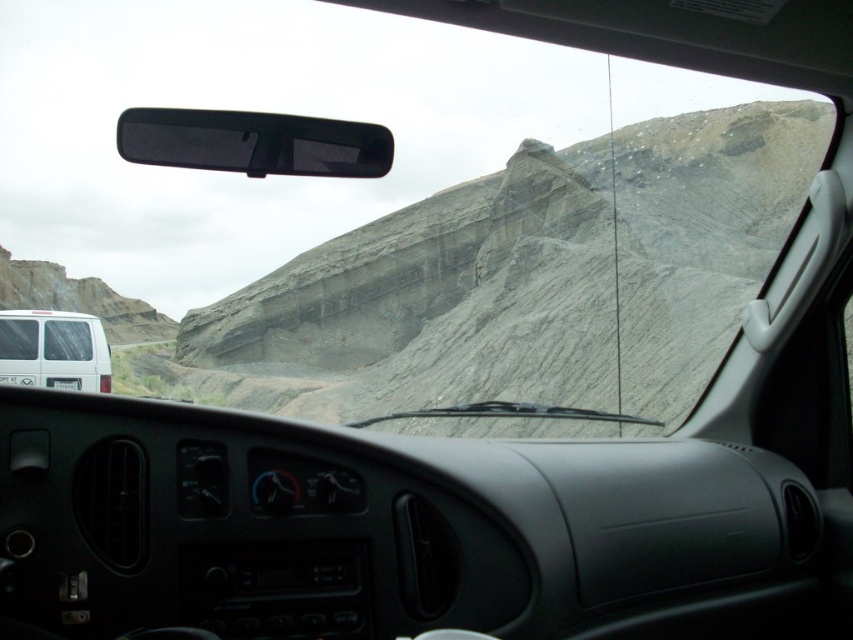
Question: Is gray rough rock at center to the left of clear glass windshield at left from the viewer's perspective?

Choices:
 (A) no
 (B) yes

Answer: (A)

Question: Which point is closer to the camera?

Choices:
 (A) (56, 348)
 (B) (0, 349)
 (C) (573, 218)

Answer: (B)

Question: Among these objects, which one is farthest from the camera?

Choices:
 (A) clear glass windshield at left
 (B) white matte van at left
 (C) gray rough rock at center

Answer: (A)

Question: Which point appears closest to the camera in this image?

Choices:
 (A) (584, 220)
 (B) (1, 336)

Answer: (B)

Question: Is white matte van at left positioned at the back of clear glass windshield at left?

Choices:
 (A) yes
 (B) no

Answer: (B)

Question: Where is gray rough rock at center located in relation to clear glass windshield at left in the image?

Choices:
 (A) left
 (B) right

Answer: (B)